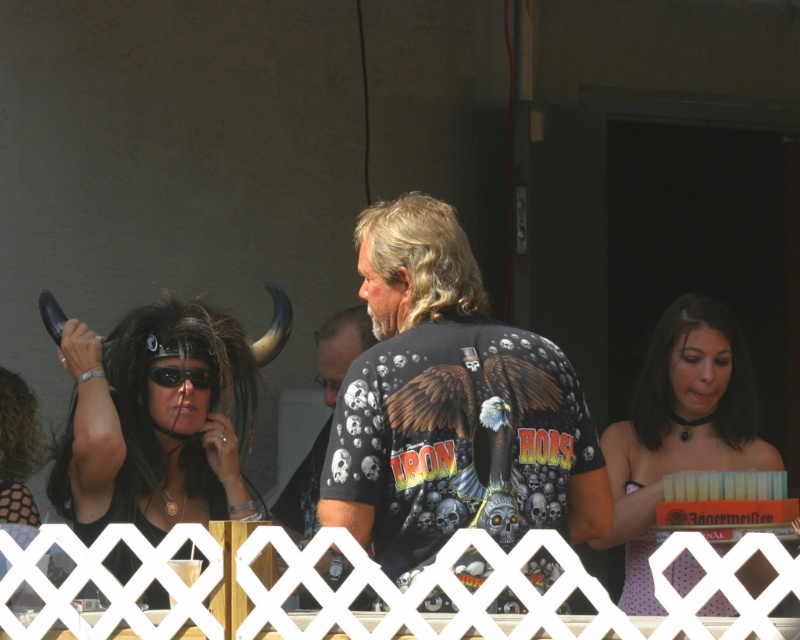
Which is in front, point (322, 490) or point (358, 230)?

Point (322, 490) is more forward.

Does point (448, 337) come farther from viewer compared to point (364, 230)?

No.

Where is `black matte t-shirt with eagle design at center`? This screenshot has height=640, width=800. black matte t-shirt with eagle design at center is located at coordinates (450, 406).

Which is more to the left, matte black helmet at left or black matte goggles at upper center?

matte black helmet at left is more to the left.

Consider the image. Who is positioned more to the right, matte black helmet at left or black matte goggles at upper center?

black matte goggles at upper center

Between point (100, 342) and point (200, 388), which one is positioned in front?

Point (100, 342) is more forward.

Image resolution: width=800 pixels, height=640 pixels. What are the coordinates of `matte black helmet at left` in the screenshot? It's located at (156, 422).

What are the coordinates of `black t-shirt with skulls at center` in the screenshot? It's located at (340, 348).

Does black t-shirt with skulls at center have a lesser height compared to black matte goggles at upper center?

No, black t-shirt with skulls at center is not shorter than black matte goggles at upper center.

Does point (336, 317) lie behind point (148, 371)?

Yes.

Where is `black t-shirt with skulls at center`? This screenshot has height=640, width=800. black t-shirt with skulls at center is located at coordinates (340, 348).